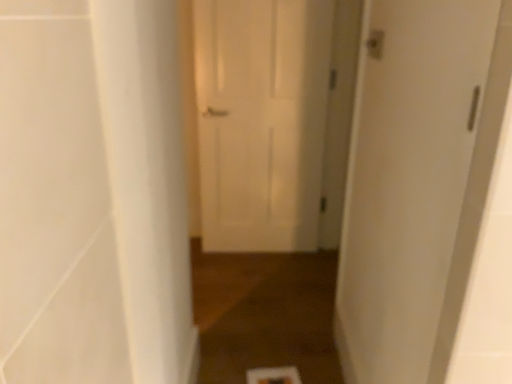
Question: Is white matte door at center, acting as the second door starting from the front, aimed at brown wood floor at center?

Choices:
 (A) no
 (B) yes

Answer: (B)

Question: Is white matte door at center, placed as the 1th door when sorted from back to front, not close to brown wood floor at center?

Choices:
 (A) no
 (B) yes

Answer: (A)

Question: Are white matte door at center, the second door from the right, and brown wood floor at center making contact?

Choices:
 (A) yes
 (B) no

Answer: (B)

Question: From a real-world perspective, is white matte door at center, placed as the 1th door when sorted from back to front, beneath brown wood floor at center?

Choices:
 (A) no
 (B) yes

Answer: (A)

Question: Is white matte door at center, acting as the second door starting from the front, at the left side of brown wood floor at center?

Choices:
 (A) no
 (B) yes

Answer: (A)

Question: Considering their positions, is white smooth pillar at left located in front of or behind white matte door at center, the first door in the left-to-right sequence?

Choices:
 (A) behind
 (B) front

Answer: (B)

Question: Is white smooth pillar at left bigger or smaller than white matte door at center, placed as the 1th door when sorted from back to front?

Choices:
 (A) big
 (B) small

Answer: (B)

Question: Considering the relative positions of white smooth pillar at left and white matte door at center, placed as the 1th door when sorted from back to front, in the image provided, is white smooth pillar at left to the left or to the right of white matte door at center, placed as the 1th door when sorted from back to front,?

Choices:
 (A) right
 (B) left

Answer: (B)

Question: From a real-world perspective, is white smooth pillar at left above or below white matte door at center, acting as the second door starting from the front?

Choices:
 (A) below
 (B) above

Answer: (B)

Question: Looking at the image, does white smooth pillar at left seem bigger or smaller compared to white matte door at right, marked as the 2th door in a back-to-front arrangement?

Choices:
 (A) small
 (B) big

Answer: (B)

Question: In the image, is white smooth pillar at left on the left side or the right side of white matte door at right, arranged as the first door when viewed from the right?

Choices:
 (A) left
 (B) right

Answer: (A)

Question: Considering the positions of point (121, 153) and point (448, 142), is point (121, 153) closer or farther from the camera than point (448, 142)?

Choices:
 (A) farther
 (B) closer

Answer: (B)

Question: From the image's perspective, is white smooth pillar at left located above or below white matte door at right, arranged as the first door when viewed from the right?

Choices:
 (A) above
 (B) below

Answer: (B)

Question: In terms of width, does white matte door at right, arranged as the second door when viewed from the left, look wider or thinner when compared to brown wood floor at center?

Choices:
 (A) thin
 (B) wide

Answer: (A)

Question: From a real-world perspective, is white matte door at right, marked as the 2th door in a back-to-front arrangement, positioned above or below brown wood floor at center?

Choices:
 (A) above
 (B) below

Answer: (A)